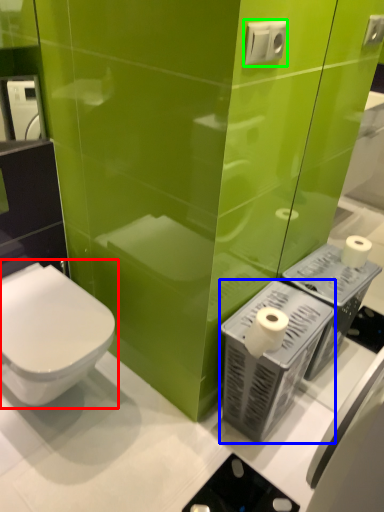
Question: Considering the real-world distances, which object is farthest from toilet (highlighted by a red box)? appliance (highlighted by a blue box) or electric outlet (highlighted by a green box)?

Choices:
 (A) appliance
 (B) electric outlet

Answer: (B)